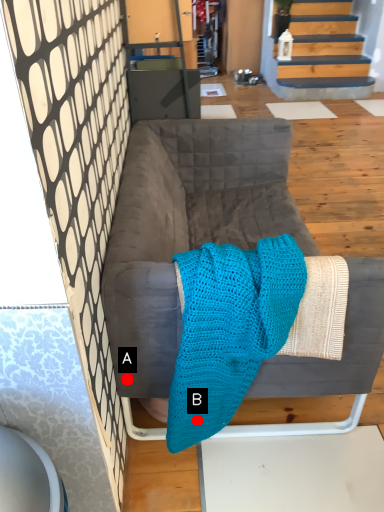
Question: Two points are circled on the image, labeled by A and B beside each circle. Which of the following is the farthest from the observer?

Choices:
 (A) A is further
 (B) B is further

Answer: (A)